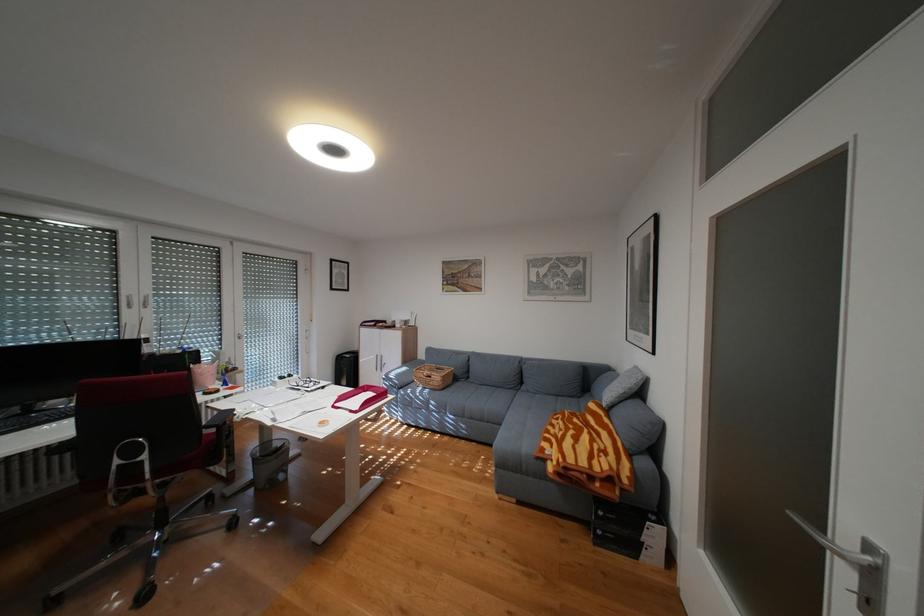
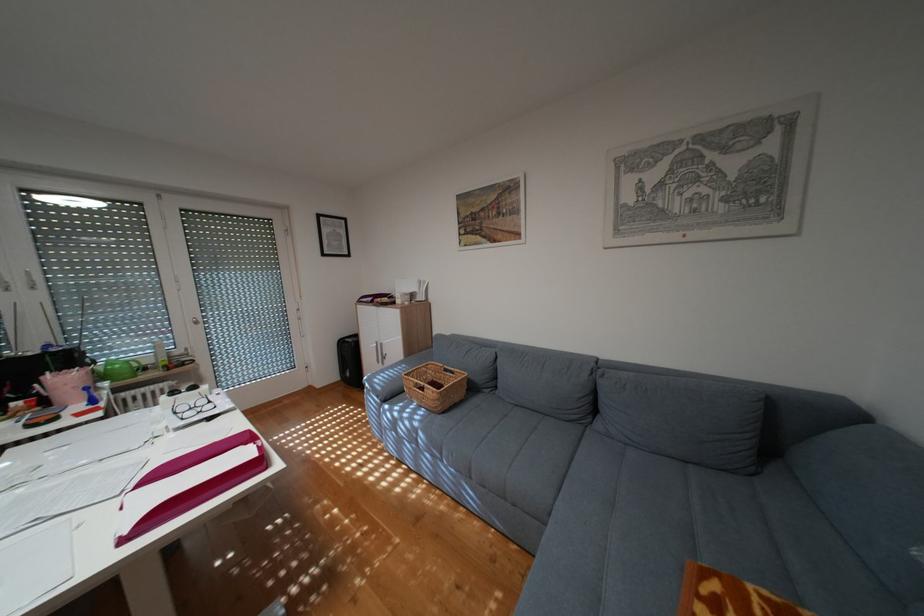
Question: The images are taken continuously from a first-person perspective. In which direction are you moving?

Choices:
 (A) Left
 (B) Right
 (C) Forward
 (D) Backward

Answer: (C)